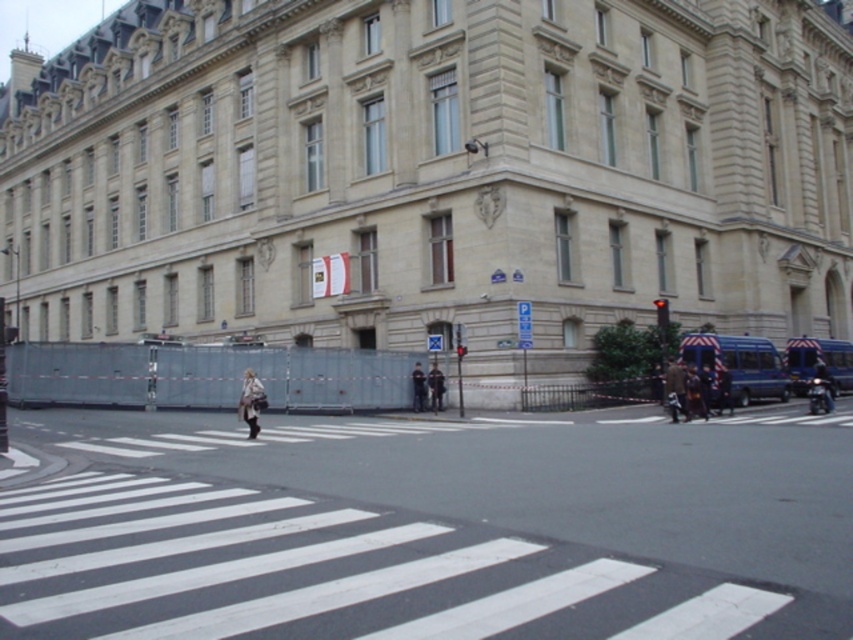
Who is positioned more to the left, light beige fabric coat at center or dark blue leather jacket at lower right?

From the viewer's perspective, light beige fabric coat at center appears more on the left side.

Consider the image. Is light beige fabric coat at center taller than dark blue leather jacket at lower right?

Yes.

What do you see at coordinates (251, 403) in the screenshot? This screenshot has width=853, height=640. I see `light beige fabric coat at center` at bounding box center [251, 403].

Where is `light beige fabric coat at center`? light beige fabric coat at center is located at coordinates (251, 403).

Image resolution: width=853 pixels, height=640 pixels. What do you see at coordinates (425, 529) in the screenshot? I see `white asphalt crosswalk at center` at bounding box center [425, 529].

The image size is (853, 640). I want to click on white asphalt crosswalk at center, so click(425, 529).

Find the location of a particular element. Image resolution: width=853 pixels, height=640 pixels. white asphalt crosswalk at center is located at coordinates (425, 529).

Does white asphalt crosswalk at center have a lesser width compared to dark gray uniform at center?

Incorrect, white asphalt crosswalk at center's width is not less than dark gray uniform at center's.

Which is behind, point (344, 493) or point (439, 374)?

The point (439, 374) is more distant.

Locate an element on the screen. white asphalt crosswalk at center is located at coordinates (425, 529).